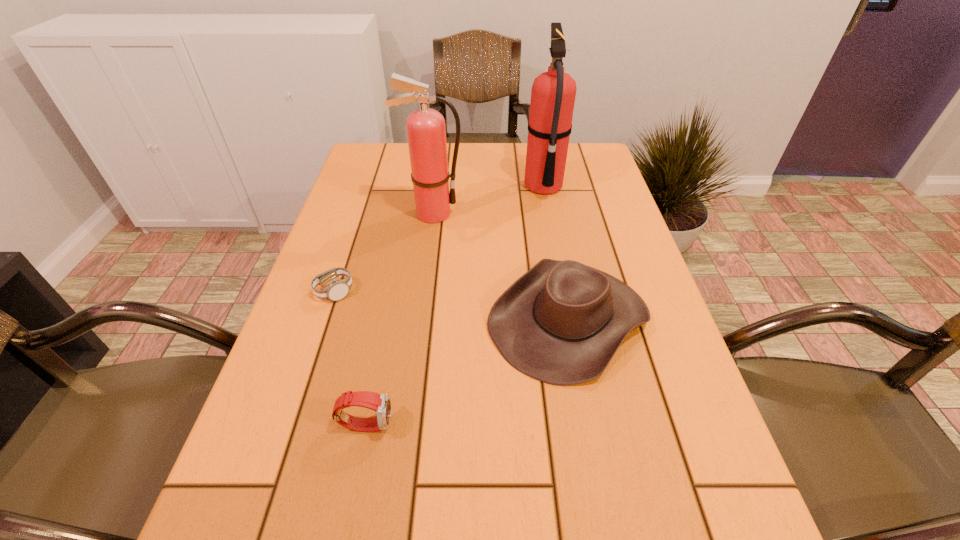
You are a GUI agent. You are given a task and a screenshot of the screen. Output one action in this format:
    pyautogui.click(x=<x>, y=<y>)
    Task: Click on the free spot that satisfies the following two spatial constraints: 1. on the face of the leftmost object; 2. on the left side of the third tallest object
    Image resolution: width=960 pixels, height=540 pixels.
    Given the screenshot: What is the action you would take?
    pyautogui.click(x=325, y=319)

Locate an element on the screen. The width and height of the screenshot is (960, 540). free spot that satisfies the following two spatial constraints: 1. on the hose direction of the left fire extinguisher; 2. on the back side of the cowboy hat is located at coordinates (419, 319).